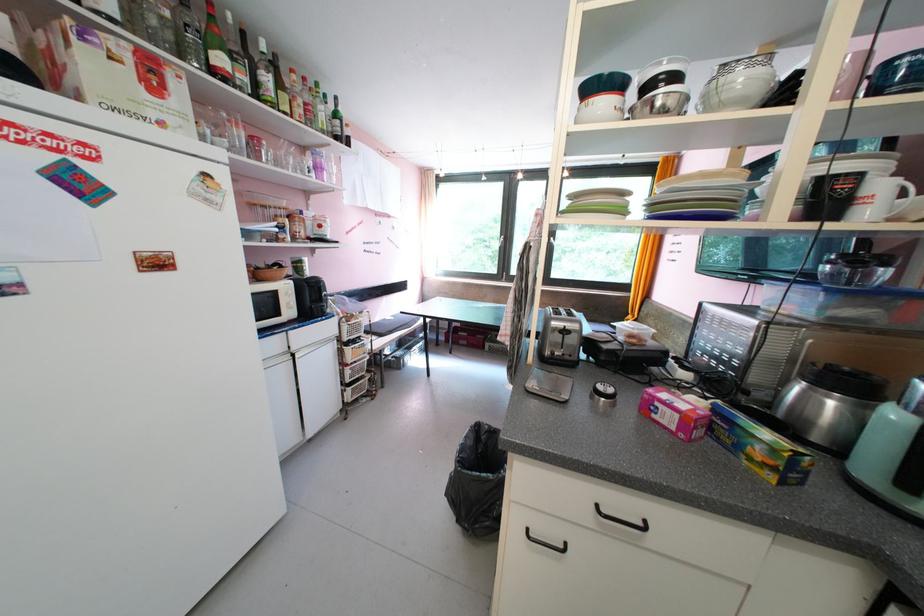
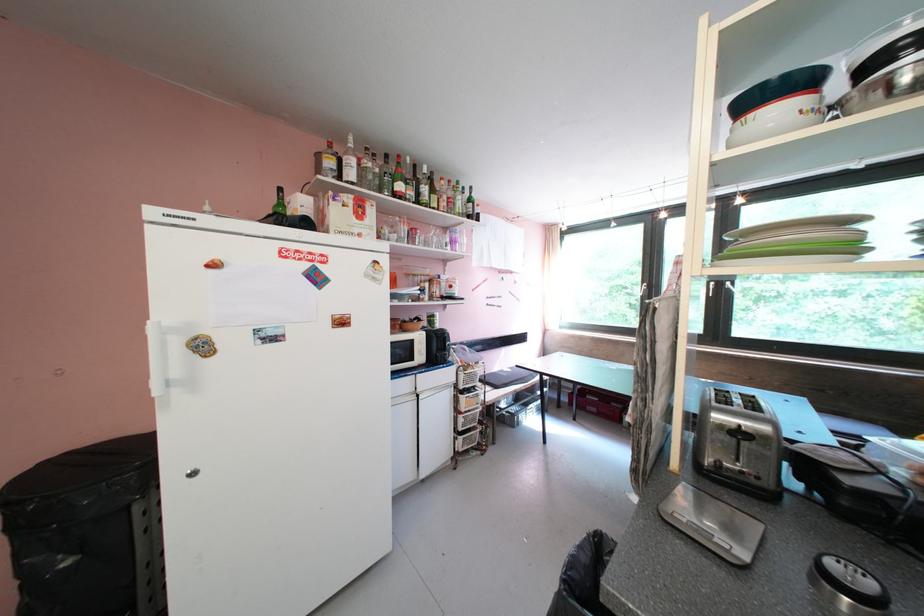
Question: The first image is from the beginning of the video and the second image is from the end. How did the camera likely rotate when shooting the video?

Choices:
 (A) Left
 (B) Right
 (C) Up
 (D) Down

Answer: (A)